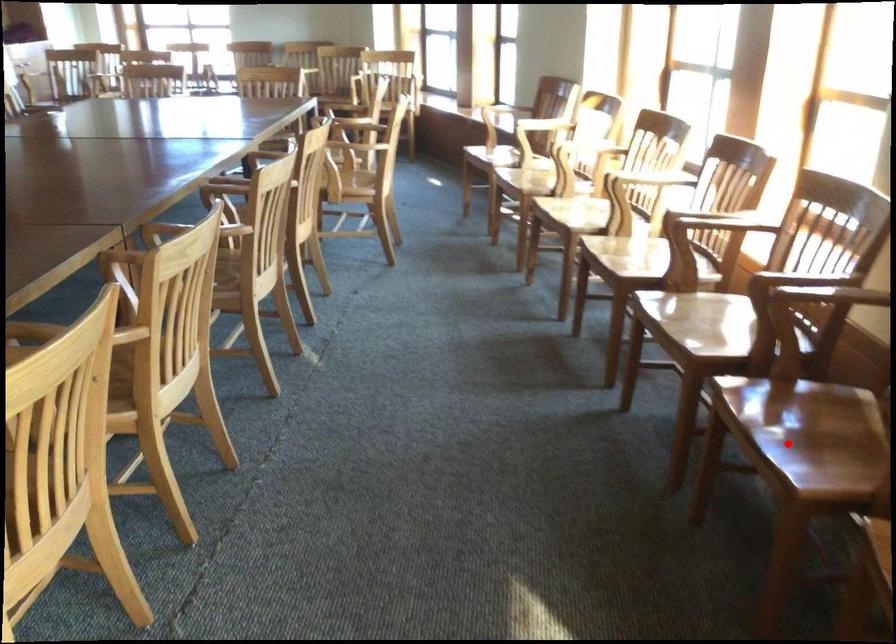
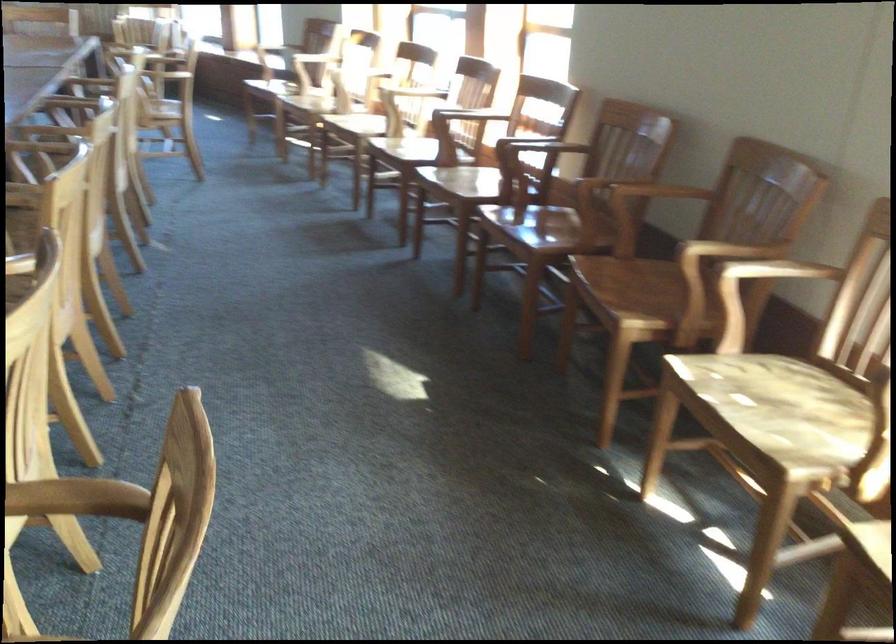
Question: I am providing you with two images of the same scene from different viewpoints. A red point is shown in image1. For the corresponding object point in image2, is it positioned nearer or farther from the camera?

Choices:
 (A) Nearer
 (B) Farther

Answer: (B)